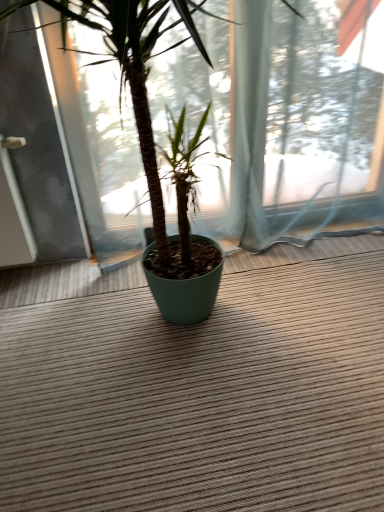
Locate an element on the screen. The image size is (384, 512). vacant area that is situated to the right of green textured pot at center is located at coordinates (322, 305).